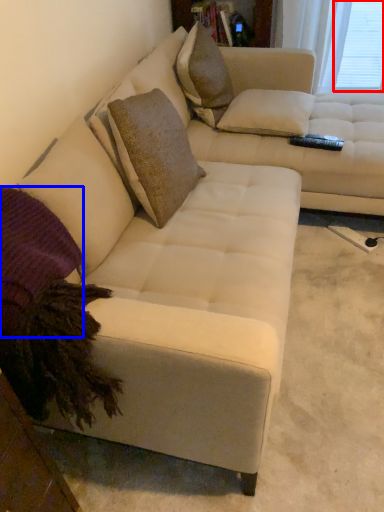
Question: Which object appears farthest to the camera in this image, window screen (highlighted by a red box) or pillow (highlighted by a blue box)?

Choices:
 (A) window screen
 (B) pillow

Answer: (A)